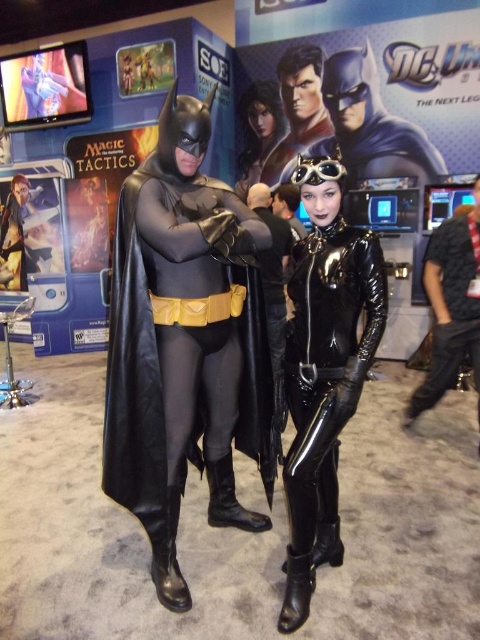
Can you confirm if matte black suit at right is positioned to the left of glossy black costume at center?

No, matte black suit at right is not to the left of glossy black costume at center.

Is matte black suit at right positioned at the back of glossy black costume at center?

No, matte black suit at right is closer to the viewer.

Where is `matte black suit at right`? This screenshot has width=480, height=640. matte black suit at right is located at coordinates (451, 307).

Is black latex bodysuit at center bigger than glossy black costume at center?

No.

Can you confirm if black latex bodysuit at center is positioned below glossy black costume at center?

Yes, black latex bodysuit at center is below glossy black costume at center.

I want to click on black latex bodysuit at center, so click(x=327, y=371).

Does point (253, 368) come farther from viewer compared to point (262, 81)?

No, (253, 368) is in front of (262, 81).

Is matte black costume at center smaller than glossy black costume at center?

Actually, matte black costume at center might be larger than glossy black costume at center.

Locate an element on the screen. The width and height of the screenshot is (480, 640). matte black costume at center is located at coordinates (186, 339).

I want to click on matte black costume at center, so click(186, 339).